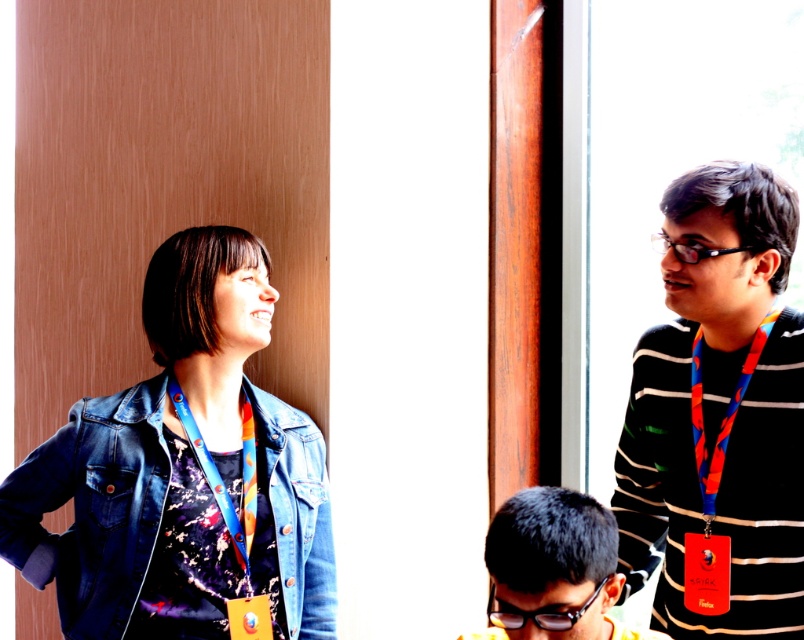
You are a photographer trying to capture a clear shot of both the striped sweater at right and the black textured hair at lower center. Which object should you adjust your focus to first to ensure it appears sharp in the final photo?

You should focus on the striped sweater at right first because it is closer to the viewer than the black textured hair at lower center, ensuring it stays sharp before adjusting for the other object.

Based on the scene description, where is the black textured hair at lower center located in terms of coordinates?

The black textured hair at lower center is located at coordinates point (554, 568).

You are organizing a clothing donation drive and need to determine which item takes up more space between the denim jacket at left and the blue fabric lanyard at left. Which item requires more storage space?

Answer: The denim jacket at left is bigger than the blue fabric lanyard at left, so it requires more storage space.